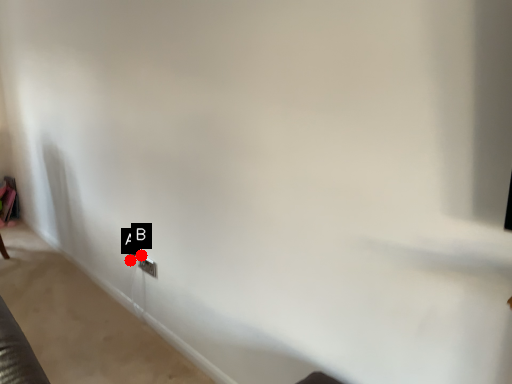
Question: Two points are circled on the image, labeled by A and B beside each circle. Which of the following is the farthest from the observer?

Choices:
 (A) A is further
 (B) B is further

Answer: (A)